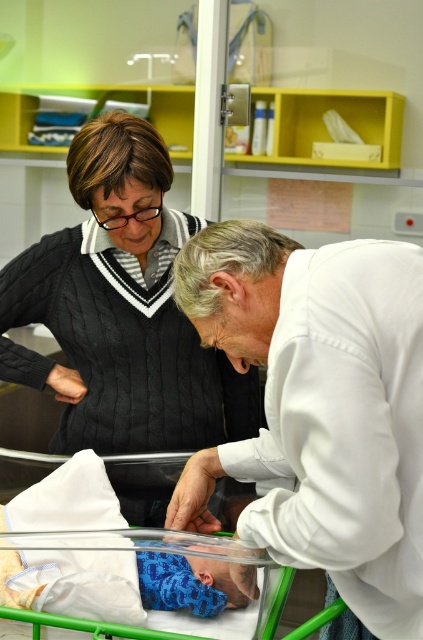
You are a nurse in the hospital and need to determine which object is taller between the white smooth coat at center and the blue knitted fabric at center. Based on the scene description, which one is taller?

The white smooth coat at center is much taller than the blue knitted fabric at center according to the description.